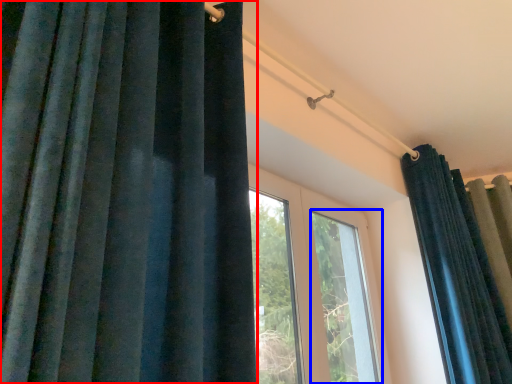
Question: Which object is closer to the camera taking this photo, curtain (highlighted by a red box) or window (highlighted by a blue box)?

Choices:
 (A) curtain
 (B) window

Answer: (A)